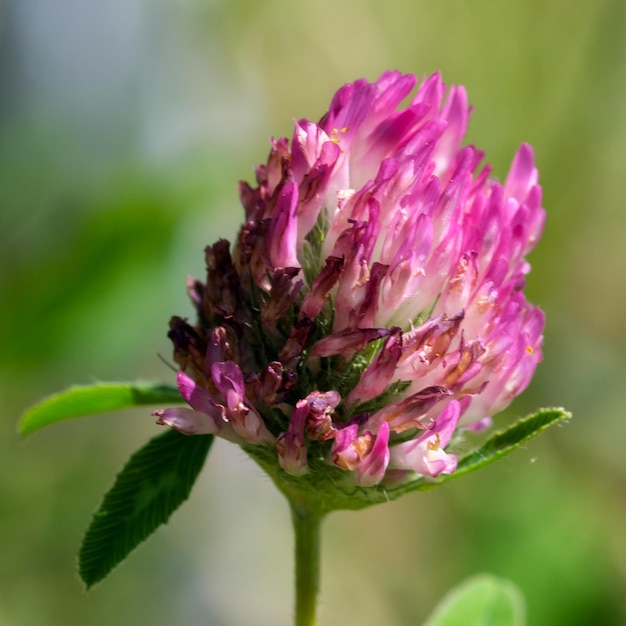
The image size is (626, 626). Identify the location of bottom pedestals. (303, 463).